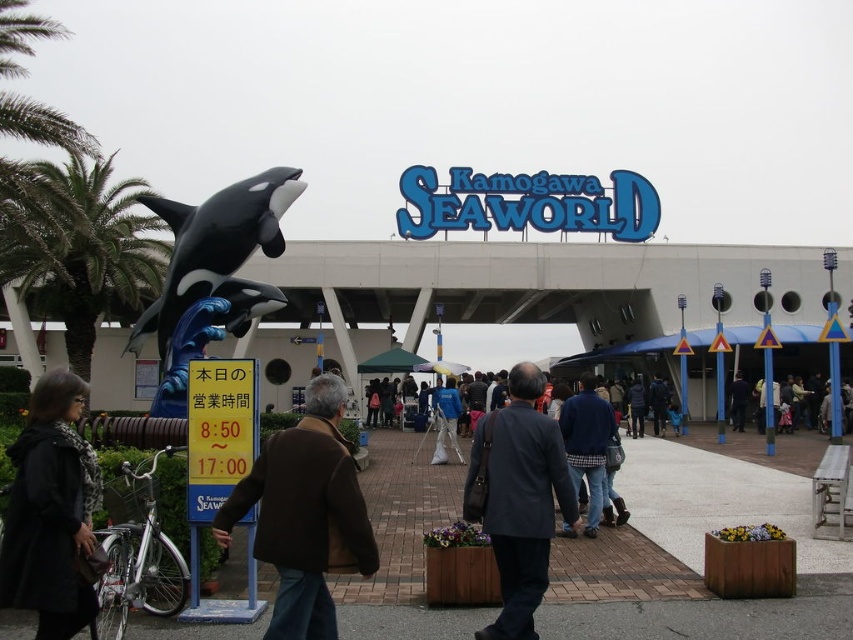
You are a photographer standing at the entrance of Kamogawa SeaWorld. You want to take a photo that includes both the brown leather jacket at center and the plaid fabric shirt at center. Given that your camera has a maximum focus range of 80 meters, will you be able to capture both items in focus without moving your position?

The brown leather jacket at center is 84.24 meters from the plaid fabric shirt at center. Since the distance exceeds the camera maximum focus range of 80 meters, you cannot capture both items in focus without moving your position.

From the picture: You are a visitor at Kamogawa SeaWorld and you see the black matte coat at lower left and the plaid fabric shirt at center. Which clothing item is closer to the entrance of the marine park?

The black matte coat at lower left is positioned under the plaid fabric shirt at center, so it is closer to the entrance since it is lower in the image.